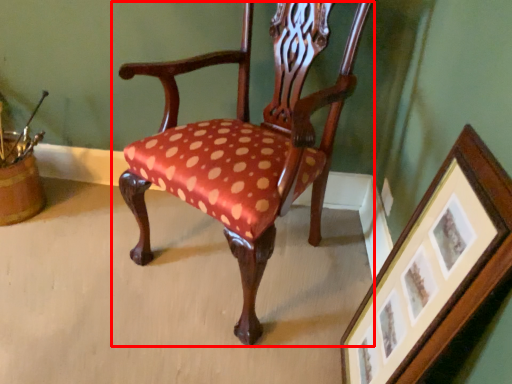
Question: Where is chair (annotated by the red box) located in relation to picture frame in the image?

Choices:
 (A) left
 (B) right

Answer: (A)